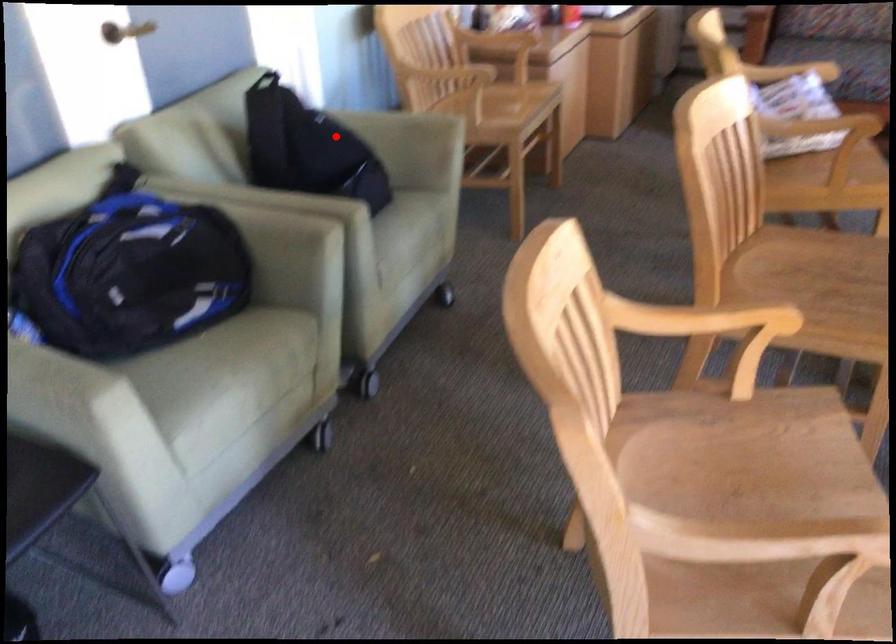
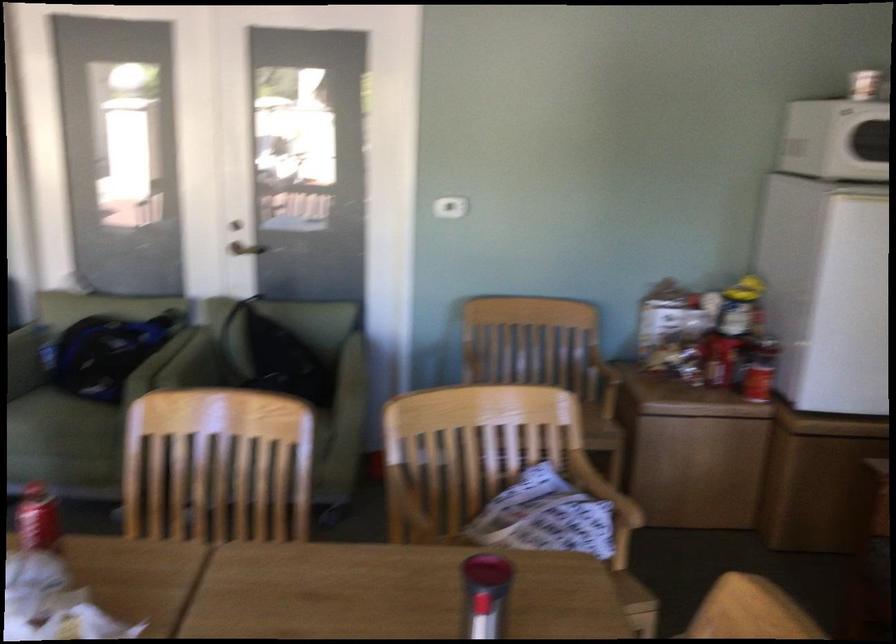
Question: A red point is marked in image1. In image2, is the corresponding 3D point closer to the camera or farther? Reply with the corresponding letter.

Choices:
 (A) The corresponding 3D point is closer.
 (B) The corresponding 3D point is farther.

Answer: (B)